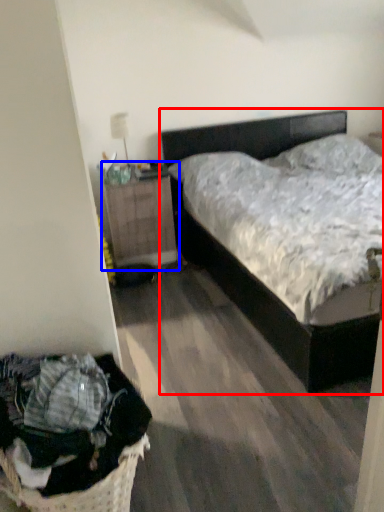
Question: Which of the following is the closest to the observer, bed (highlighted by a red box) or nightstand (highlighted by a blue box)?

Choices:
 (A) bed
 (B) nightstand

Answer: (A)